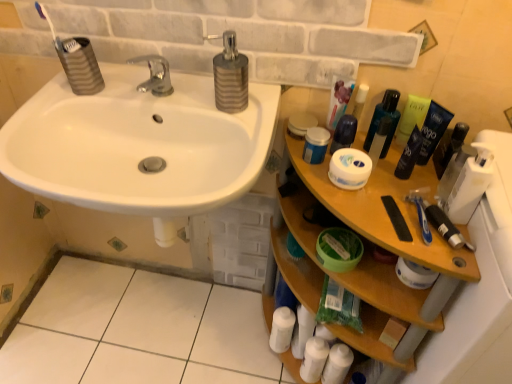
Image resolution: width=512 pixels, height=384 pixels. What are the coordinates of `free space in front of white matte bottle at lower center, marked as the 2th toiletry in a top-to-bottom arrangement` in the screenshot? It's located at (274, 372).